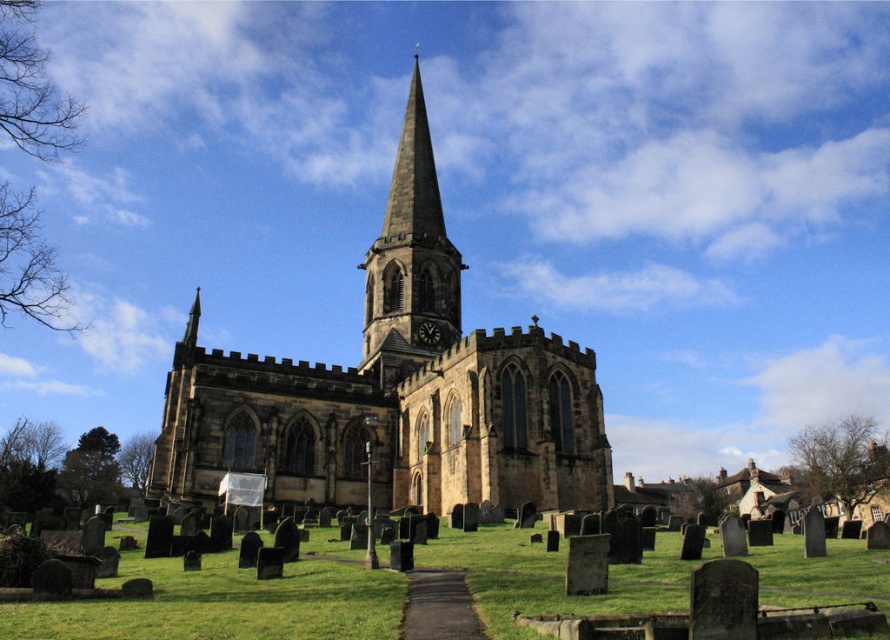
Looking at this image, you are standing at a viewpoint 60 meters away from the brown stone church at center. Can you safely walk towards it without any obstacles? Please explain your reasoning based on the scene description.

The brown stone church at center is 62.17 meters away from the camera. Since you are standing at a viewpoint 60 meters away, you are actually closer to the church than the camera. However, the scene description mentions a graveyard with numerous gravestones in front of the church. These gravestones could potentially block your path or require navigation around them, so it is not guaranteed that you can walk towards the church without obstacles.

You are standing at the entrance of the historic church and see two points marked in the graveyard. The first point is labeled as point (524, 454) and the second is point (196, 604). Which point is closer to the church building?

Point (524, 454) is behind point (196, 604), so the point closer to the church building is point (196, 604).

You are standing in front of the historic church and want to place a new flowerpot at the base of the smooth stone spire at center. Can you determine if the green grass at lower center will be visible from the flowerpot location?

The green grass at lower center is in front of the smooth stone spire at center, so placing the flowerpot at the base of the spire would mean the grass is between you and the spire. Therefore, the green grass at lower center would be visible from the flowerpot location.